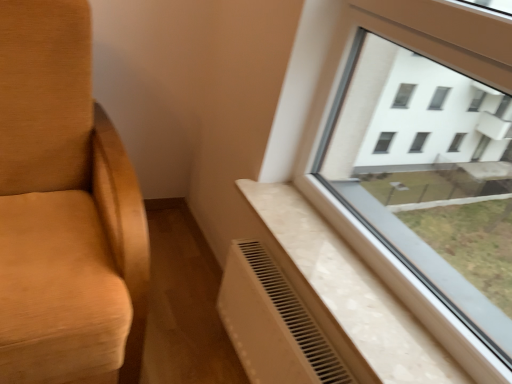
At what (x,y) coordinates should I click in order to perform the action: click on vacant space situated above white textured radiator at lower right (from a real-world perspective). Please return your answer as a coordinate pair (x, y). The width and height of the screenshot is (512, 384). Looking at the image, I should click on (343, 265).